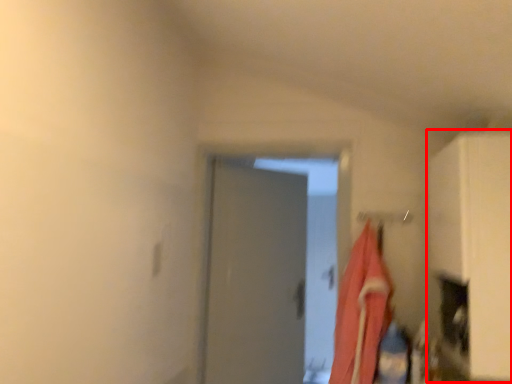
Question: From the image's perspective, where is cabinetry (annotated by the red box) located in relation to laundry in the image?

Choices:
 (A) below
 (B) above

Answer: (B)